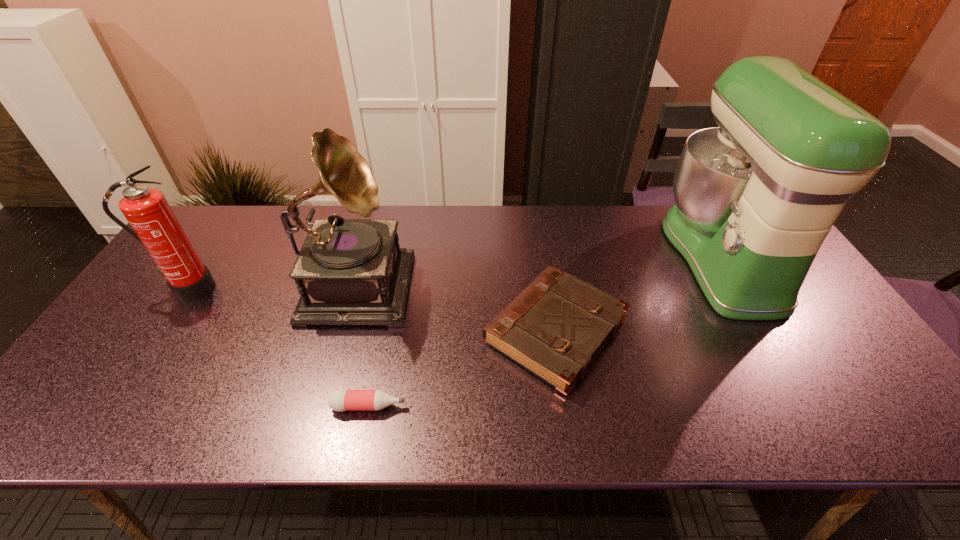
This screenshot has width=960, height=540. I want to click on mixer, so click(755, 198).

Locate an element on the screen. The height and width of the screenshot is (540, 960). record player is located at coordinates (349, 271).

The height and width of the screenshot is (540, 960). I want to click on the leftmost object, so click(147, 211).

The width and height of the screenshot is (960, 540). Identify the location of fire extinguisher. (147, 211).

This screenshot has height=540, width=960. Find the location of `the fourth tallest object`. the fourth tallest object is located at coordinates (555, 328).

Where is `the fourth object from left to right`? This screenshot has height=540, width=960. the fourth object from left to right is located at coordinates (555, 328).

Where is `bottle`? bottle is located at coordinates (341, 400).

Locate an element on the screen. The image size is (960, 540). free space located 0.220m on the controls of the rightmost object is located at coordinates (597, 256).

Locate an element on the screen. This screenshot has height=540, width=960. vacant space located on the controls of the rightmost object is located at coordinates (590, 256).

This screenshot has height=540, width=960. I want to click on free space located on the controls of the rightmost object, so click(633, 256).